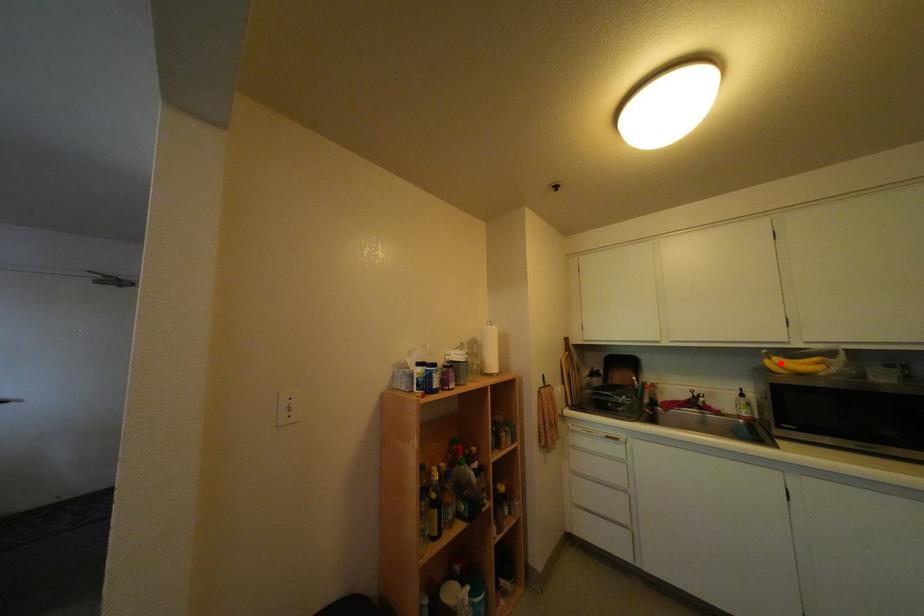
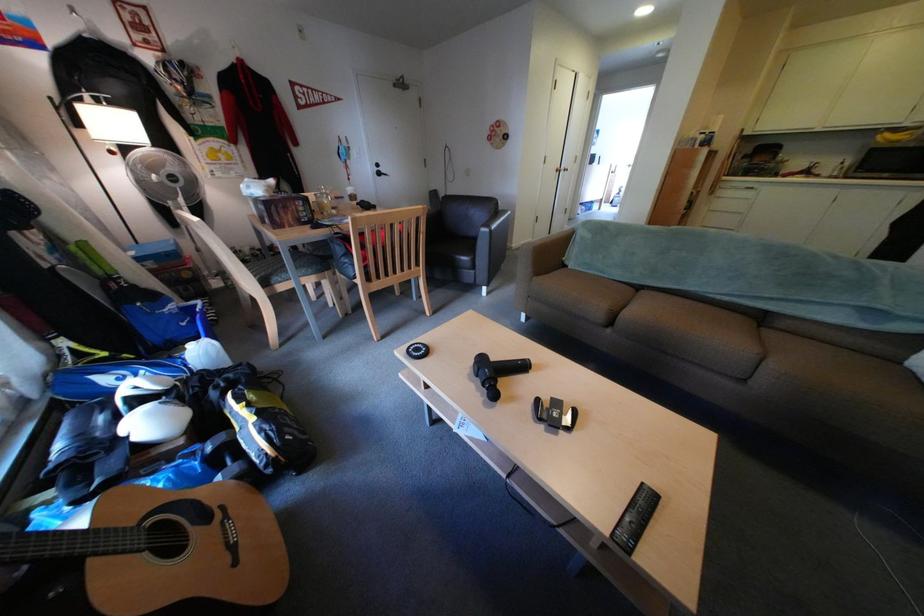
The point at the highlighted location is marked in the first image. Where is the corresponding point in the second image?

(894, 138)